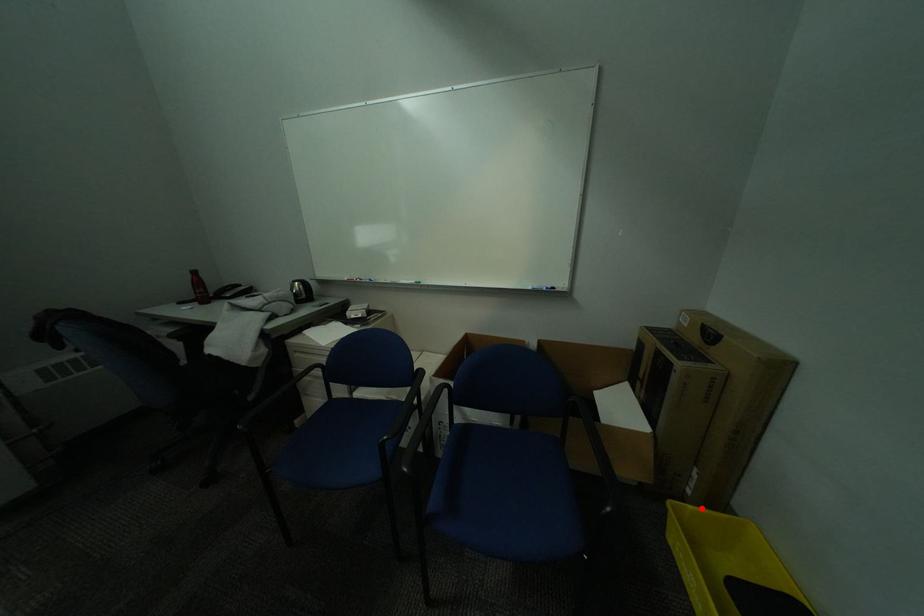
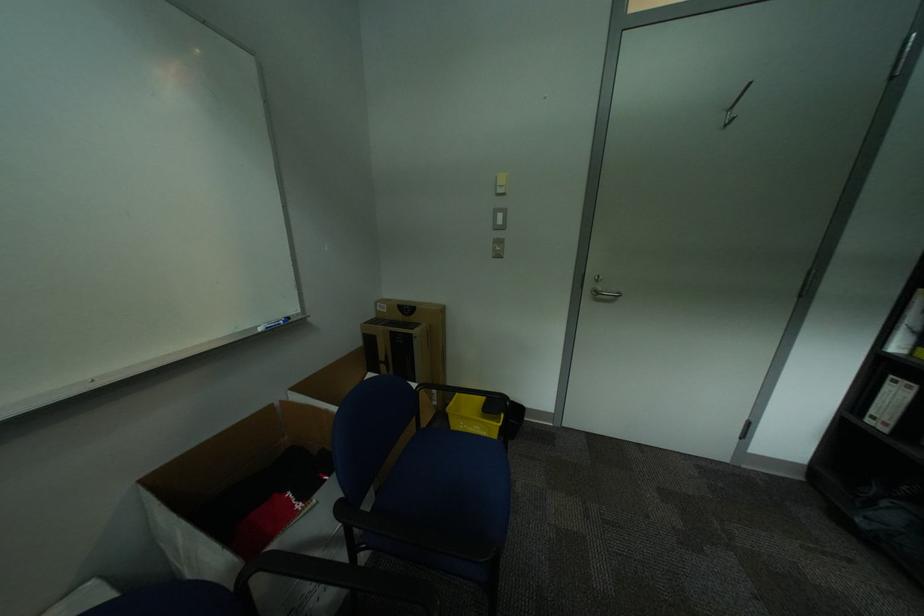
Question: I am providing you with two images of the same scene from different viewpoints. Given a red point in image1, look at the same physical point in image2. Is it:

Choices:
 (A) Closer to the viewpoint
 (B) Farther from the viewpoint

Answer: (B)